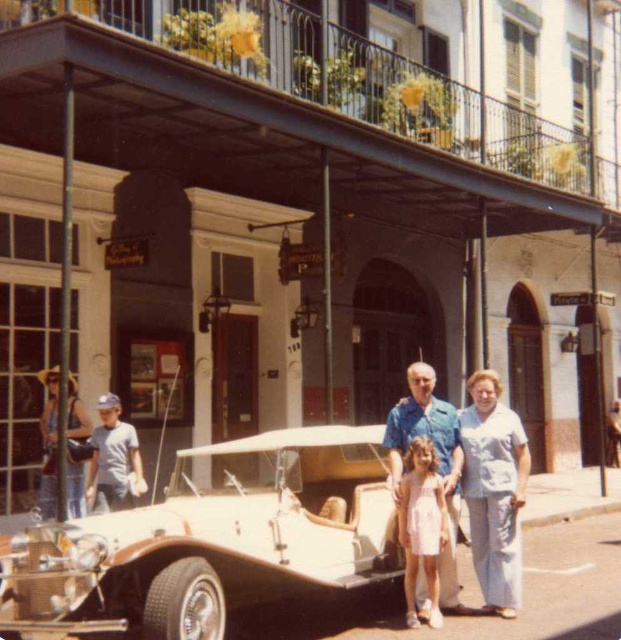
Does light blue fabric pants at right have a lesser height compared to pink satin dress at center?

In fact, light blue fabric pants at right may be taller than pink satin dress at center.

Which is more to the right, light blue fabric pants at right or pink satin dress at center?

light blue fabric pants at right is more to the right.

In order to click on light blue fabric pants at right in this screenshot , I will do `click(492, 490)`.

Can you confirm if blue cotton shirt at center is taller than pink satin dress at center?

Correct, blue cotton shirt at center is much taller as pink satin dress at center.

Is blue cotton shirt at center bigger than pink satin dress at center?

Yes, blue cotton shirt at center is bigger than pink satin dress at center.

Where is `blue cotton shirt at center`? blue cotton shirt at center is located at coordinates (437, 461).

Which of these two, beige leather car at center or pink satin dress at center, stands taller?

With more height is pink satin dress at center.

Does point (222, 579) lie behind point (410, 536)?

That is False.

Identify the location of beige leather car at center. Image resolution: width=621 pixels, height=640 pixels. (212, 540).